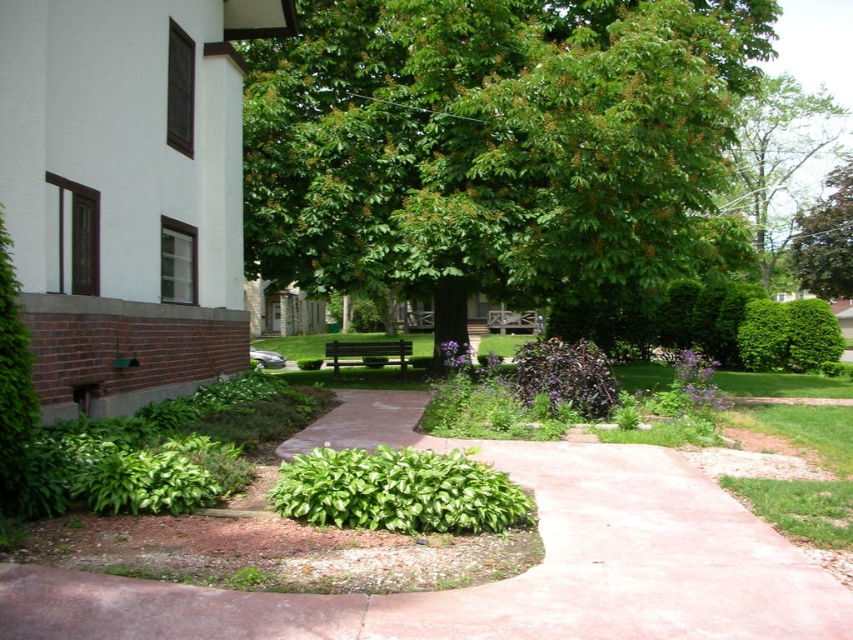
Question: Is green leafy tree at upper center wider than green leafy tree at upper right?

Choices:
 (A) yes
 (B) no

Answer: (A)

Question: Can you confirm if purple matte bush at center is positioned to the right of green leafy tree at upper right?

Choices:
 (A) no
 (B) yes

Answer: (A)

Question: Which object is farther from the camera taking this photo?

Choices:
 (A) purple matte bush at center
 (B) green leafy tree at upper center
 (C) green glossy bush at center

Answer: (B)

Question: Is green glossy bush at center above wooden park bench at center?

Choices:
 (A) no
 (B) yes

Answer: (A)

Question: Which of the following is the closest to the observer?

Choices:
 (A) purple matte bush at center
 (B) green leafy tree at upper center
 (C) green leafy tree at center

Answer: (A)

Question: Estimate the real-world distances between objects in this image. Which object is farther from the green glossy bush at center?

Choices:
 (A) wooden park bench at center
 (B) purple matte bush at center
 (C) green leafy tree at upper center

Answer: (C)